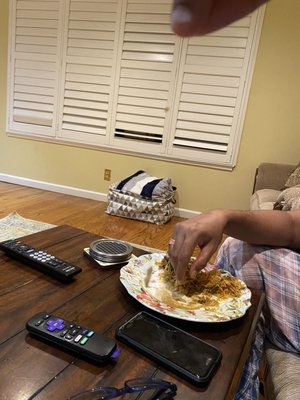
The image size is (300, 400). What are the coordinates of `wall` in the screenshot? It's located at (280, 112).